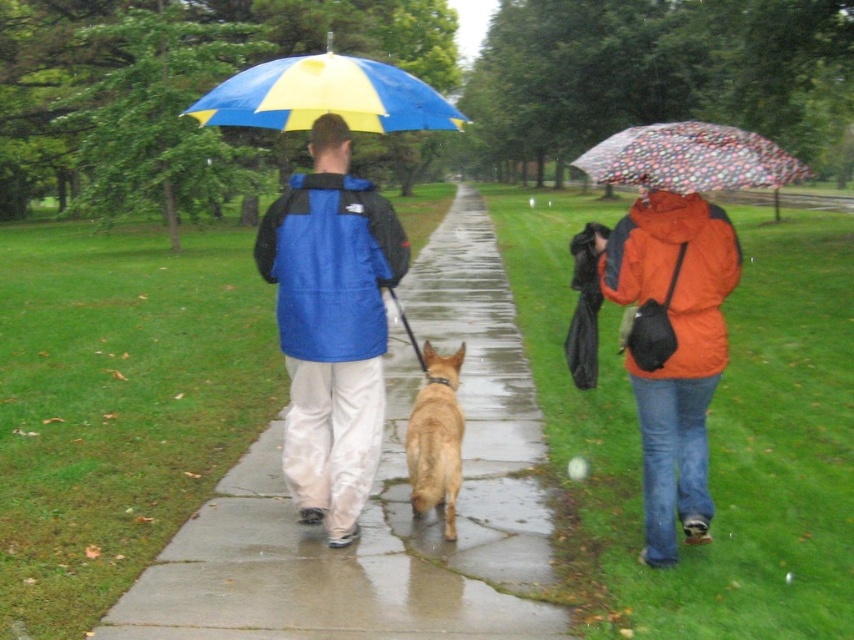
Looking at this image, does concrete sidewalk at center have a greater width compared to blue/yellow striped umbrella at upper center?

No.

Can you confirm if concrete sidewalk at center is positioned to the right of blue/yellow striped umbrella at upper center?

Correct, you'll find concrete sidewalk at center to the right of blue/yellow striped umbrella at upper center.

You are a GUI agent. You are given a task and a screenshot of the screen. Output one action in this format:
    pyautogui.click(x=<x>, y=<y>)
    Task: Click on the concrete sidewalk at center
    This screenshot has width=854, height=640.
    Given the screenshot: What is the action you would take?
    pyautogui.click(x=382, y=500)

In order to click on concrete sidewalk at center in this screenshot , I will do `click(382, 500)`.

Is point (521, 406) positioned after point (729, 176)?

Yes, it is.

Is concrete sidewalk at center taller than transparent polka dot umbrella at center?

In fact, concrete sidewalk at center may be shorter than transparent polka dot umbrella at center.

Which is in front, point (171, 593) or point (700, 172)?

Positioned in front is point (700, 172).

Locate an element on the screen. This screenshot has width=854, height=640. concrete sidewalk at center is located at coordinates (382, 500).

Is transparent polka dot umbrella at center wider than brown fur dog at center?

Indeed, transparent polka dot umbrella at center has a greater width compared to brown fur dog at center.

The image size is (854, 640). Describe the element at coordinates (689, 157) in the screenshot. I see `transparent polka dot umbrella at center` at that location.

Identify the location of transparent polka dot umbrella at center. (689, 157).